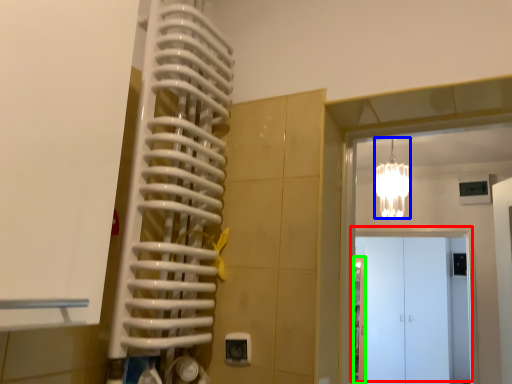
Question: Which object is positioned closest to door (highlighted by a red box)? Select from light fixture (highlighted by a blue box) and door (highlighted by a green box).

Choices:
 (A) light fixture
 (B) door

Answer: (B)